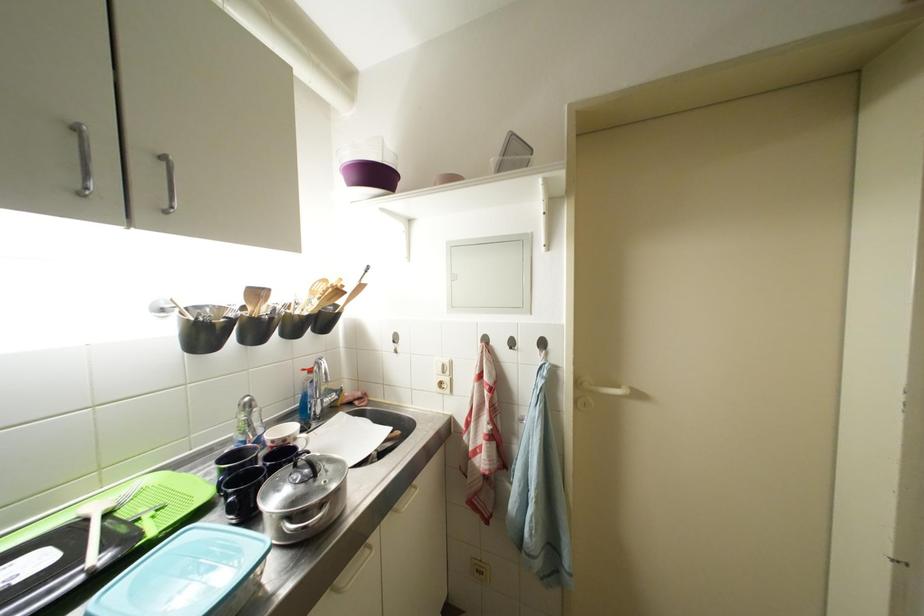
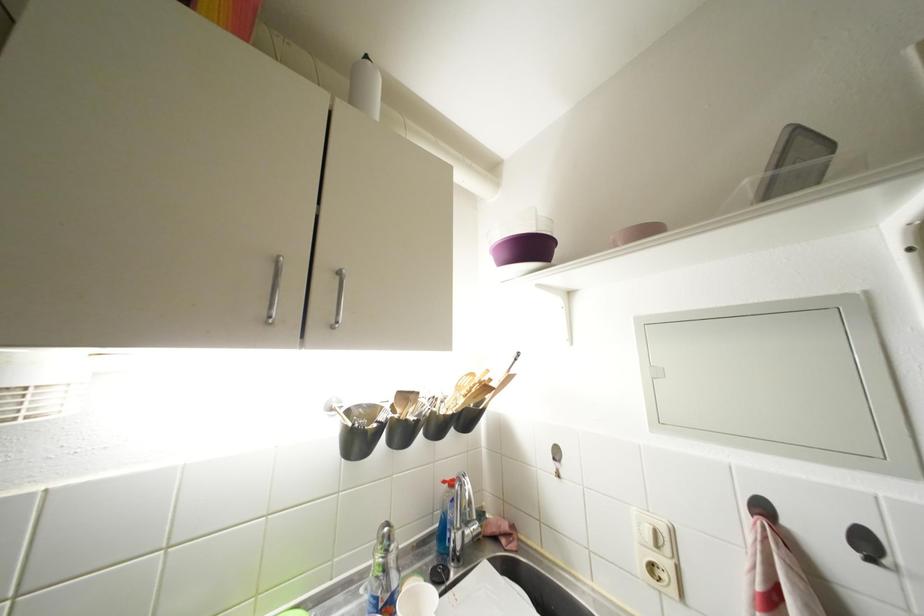
The point at (399, 350) is marked in the first image. Where is the corresponding point in the second image?

(560, 469)